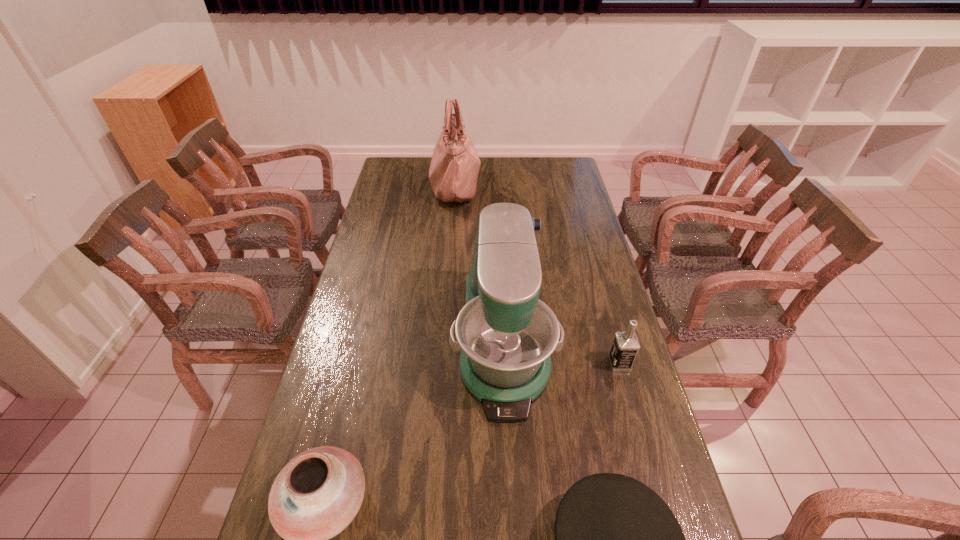
Locate an element on the screen. Image resolution: width=960 pixels, height=540 pixels. blank space at the far edge of the desktop is located at coordinates (511, 159).

Where is `free region at the left edge`? The height and width of the screenshot is (540, 960). free region at the left edge is located at coordinates (354, 416).

The height and width of the screenshot is (540, 960). Identify the location of vacant space at the right edge of the desktop. (643, 452).

The image size is (960, 540). I want to click on vacant space at the far right corner, so click(557, 160).

Identify which object is located as the third nearest to the handbag. Please provide its 2D coordinates. Your answer should be formatted as a tuple, i.e. [(x, y)], where the tuple contains the x and y coordinates of a point satisfying the conditions above.

[(317, 494)]

At what (x,y) coordinates should I click in order to perform the action: click on the second closest object relative to the handbag. Please return your answer as a coordinate pair (x, y). The width and height of the screenshot is (960, 540). Looking at the image, I should click on (626, 345).